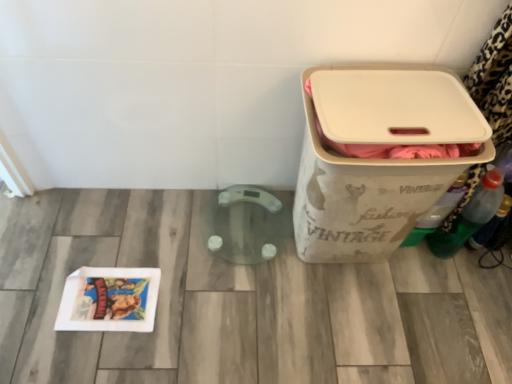
What are the coordinates of `free location to the left of translucent plastic bottle at right, the first bottle when ordered from right to left` in the screenshot? It's located at (438, 261).